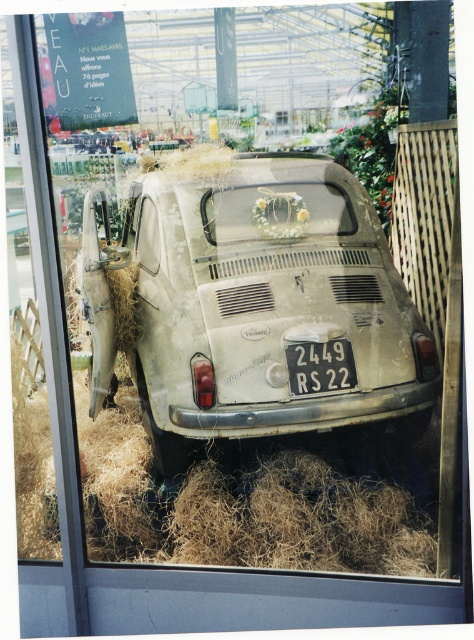
Is dirty white car at center taller than white plastic license plate at center?

Indeed, dirty white car at center has a greater height compared to white plastic license plate at center.

Which is more to the left, dirty white car at center or white plastic license plate at center?

Positioned to the left is dirty white car at center.

The height and width of the screenshot is (640, 474). Find the location of `dirty white car at center`. dirty white car at center is located at coordinates (247, 300).

Find the location of a particular element. This screenshot has height=640, width=474. dirty white car at center is located at coordinates (247, 300).